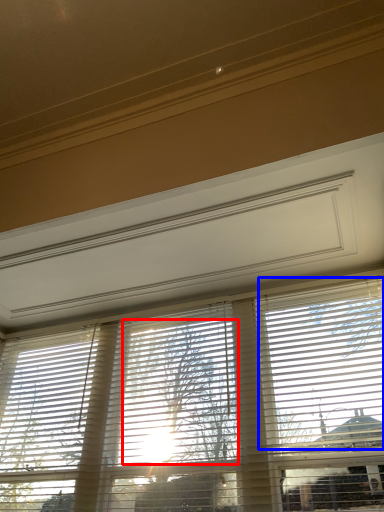
Question: Which object appears closest to the camera in this image, tree (highlighted by a red box) or blind (highlighted by a blue box)?

Choices:
 (A) tree
 (B) blind

Answer: (B)